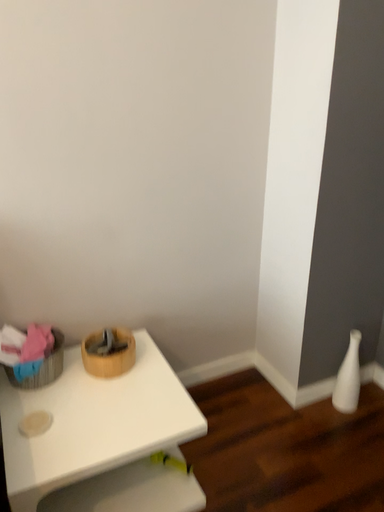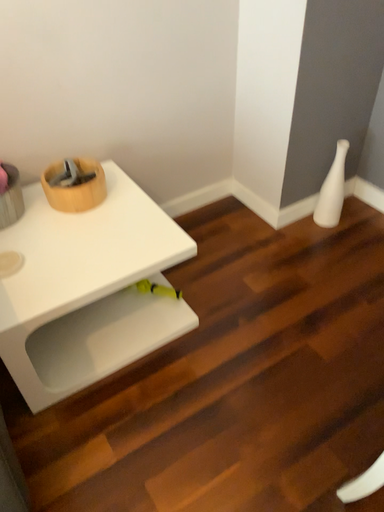
Question: How did the camera likely rotate when shooting the video?

Choices:
 (A) rotated downward
 (B) rotated upward

Answer: (A)